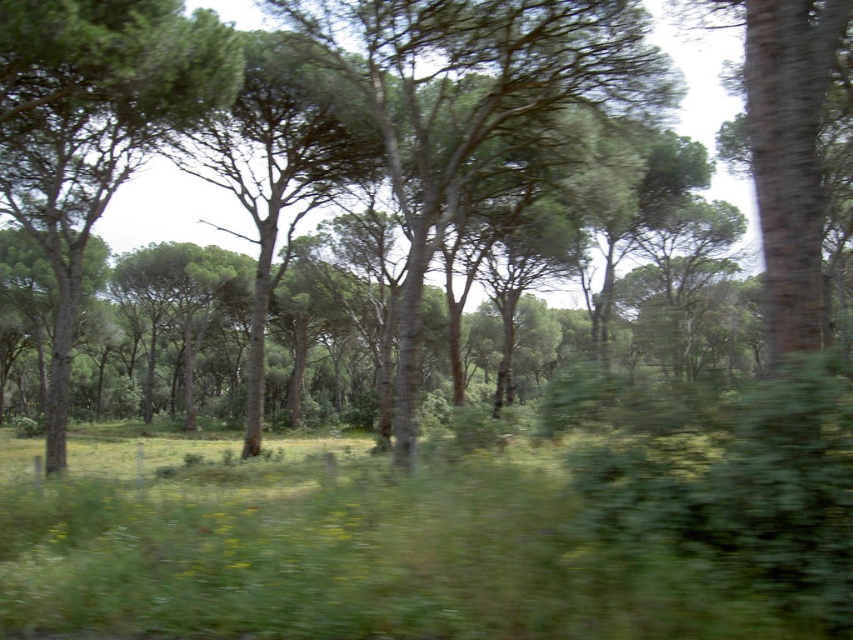
You are standing in the forest and see two points marked on the ground. The first point is at coordinate point [410,529] and the second is at point [138,163]. Which point is closer to you?

Point [410,529] is in front of point [138,163], so it is closer to you.

You are standing in the forest scene depicted. You need to place a small decorative stone on the exact spot where the green leafy grass at center is located. According to the coordinates provided, where should you place the stone?

The green leafy grass at center is located at coordinates point (341,548), so you should place the stone there.

You are a hiker trying to navigate through the forest. You notice two trees ahead of you, the green leafy tree at center and the green rough bark tree at left. Which tree is taller?

The green rough bark tree at left is taller than the green leafy tree at center.